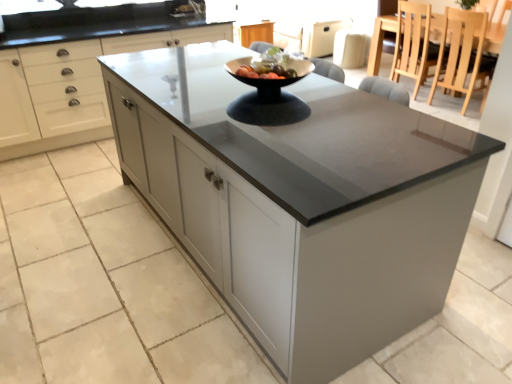
Question: Is matte white cabinets at center positioned in front of light wood chair at upper right, the 1th chair in the front-to-back sequence?

Choices:
 (A) no
 (B) yes

Answer: (B)

Question: Does matte white cabinets at center turn towards light wood chair at upper right, the 1th chair in the front-to-back sequence?

Choices:
 (A) no
 (B) yes

Answer: (A)

Question: Considering the relative sizes of matte white cabinets at center and light wood chair at upper right, marked as the second chair in a back-to-front arrangement, in the image provided, is matte white cabinets at center thinner than light wood chair at upper right, marked as the second chair in a back-to-front arrangement,?

Choices:
 (A) no
 (B) yes

Answer: (A)

Question: Is matte white cabinets at center positioned behind light wood chair at upper right, marked as the second chair in a back-to-front arrangement?

Choices:
 (A) yes
 (B) no

Answer: (B)

Question: From a real-world perspective, is matte white cabinets at center positioned under light wood chair at upper right, marked as the second chair in a back-to-front arrangement, based on gravity?

Choices:
 (A) yes
 (B) no

Answer: (B)

Question: From the image's perspective, is light wood chair at upper right, marked as the second chair in a back-to-front arrangement, located above or below light brown wooden chair at upper right, the first chair viewed from the back?

Choices:
 (A) above
 (B) below

Answer: (B)

Question: Based on their positions, is light wood chair at upper right, marked as the second chair in a back-to-front arrangement, located to the left or right of light brown wooden chair at upper right, the first chair viewed from the back?

Choices:
 (A) left
 (B) right

Answer: (B)

Question: Considering their positions, is light wood chair at upper right, marked as the second chair in a back-to-front arrangement, located in front of or behind light brown wooden chair at upper right, the first chair viewed from the back?

Choices:
 (A) front
 (B) behind

Answer: (A)

Question: Is point (461, 62) closer or farther from the camera than point (412, 44)?

Choices:
 (A) farther
 (B) closer

Answer: (B)

Question: From a real-world perspective, is white glossy bowl at center physically located above or below matte white cabinets at center?

Choices:
 (A) above
 (B) below

Answer: (A)

Question: From the image's perspective, relative to matte white cabinets at center, is white glossy bowl at center above or below?

Choices:
 (A) below
 (B) above

Answer: (A)

Question: Is white glossy bowl at center spatially inside matte white cabinets at center, or outside of it?

Choices:
 (A) inside
 (B) outside

Answer: (B)

Question: Looking at the image, does white glossy bowl at center seem bigger or smaller compared to matte white cabinets at center?

Choices:
 (A) small
 (B) big

Answer: (A)

Question: From a real-world perspective, is wooden dining table at upper right physically located above or below white glossy bowl at center?

Choices:
 (A) above
 (B) below

Answer: (B)

Question: Is wooden dining table at upper right inside or outside of white glossy bowl at center?

Choices:
 (A) inside
 (B) outside

Answer: (B)